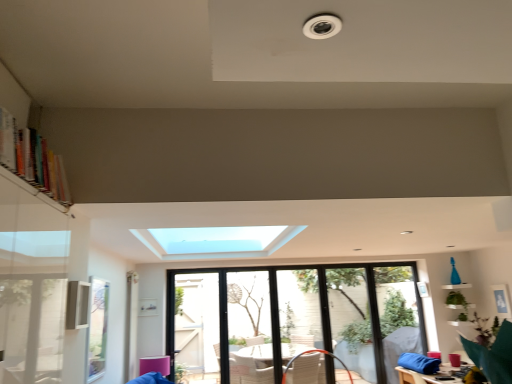
Question: Which direction should I rotate to look at transparent glass screen door at center, the first screen door in the left-to-right sequence, — up or down?

Choices:
 (A) up
 (B) down

Answer: (B)

Question: Can you confirm if multicolored wooden bookshelf at upper left is positioned to the left of transparent glass screen door at center, the first screen door in the left-to-right sequence?

Choices:
 (A) yes
 (B) no

Answer: (A)

Question: Does multicolored wooden bookshelf at upper left have a lesser height compared to transparent glass screen door at center, the first screen door in the left-to-right sequence?

Choices:
 (A) yes
 (B) no

Answer: (A)

Question: Is multicolored wooden bookshelf at upper left far from transparent glass screen door at center, which ranks as the second screen door in right-to-left order?

Choices:
 (A) yes
 (B) no

Answer: (A)

Question: Does multicolored wooden bookshelf at upper left come behind transparent glass screen door at center, which ranks as the second screen door in right-to-left order?

Choices:
 (A) yes
 (B) no

Answer: (B)

Question: Does multicolored wooden bookshelf at upper left lie in front of transparent glass screen door at center, the first screen door in the left-to-right sequence?

Choices:
 (A) no
 (B) yes

Answer: (B)

Question: Is multicolored wooden bookshelf at upper left wider than transparent glass screen door at center, which ranks as the second screen door in right-to-left order?

Choices:
 (A) yes
 (B) no

Answer: (A)

Question: Is transparent glass screen door at center, which ranks as the second screen door in right-to-left order, shorter than clear glass window screen at lower left?

Choices:
 (A) no
 (B) yes

Answer: (A)

Question: From a real-world perspective, is transparent glass screen door at center, which ranks as the second screen door in right-to-left order, beneath clear glass window screen at lower left?

Choices:
 (A) no
 (B) yes

Answer: (B)

Question: Does transparent glass screen door at center, which ranks as the second screen door in right-to-left order, have a greater height compared to clear glass window screen at lower left?

Choices:
 (A) yes
 (B) no

Answer: (A)

Question: From a real-world perspective, is transparent glass screen door at center, which ranks as the second screen door in right-to-left order, on top of clear glass window screen at lower left?

Choices:
 (A) yes
 (B) no

Answer: (B)

Question: Does transparent glass screen door at center, the first screen door in the left-to-right sequence, have a larger size compared to clear glass window screen at lower left?

Choices:
 (A) no
 (B) yes

Answer: (B)

Question: From the image's perspective, would you say transparent glass screen door at center, the first screen door in the left-to-right sequence, is positioned over clear glass window screen at lower left?

Choices:
 (A) yes
 (B) no

Answer: (B)

Question: Is multicolored wooden bookshelf at upper left thinner than clear glass window at center?

Choices:
 (A) no
 (B) yes

Answer: (A)